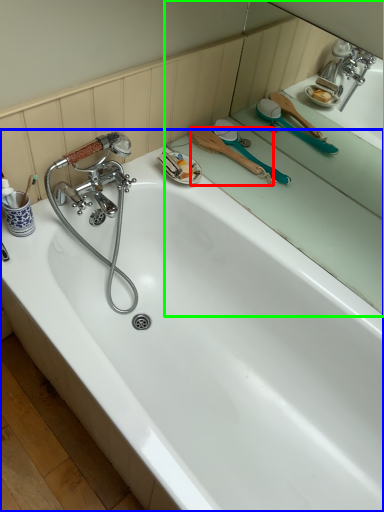
Question: Based on their relative distances, which object is farther from brush (highlighted by a red box)? Choose from bathtub (highlighted by a blue box) and mirror (highlighted by a green box).

Choices:
 (A) bathtub
 (B) mirror

Answer: (A)